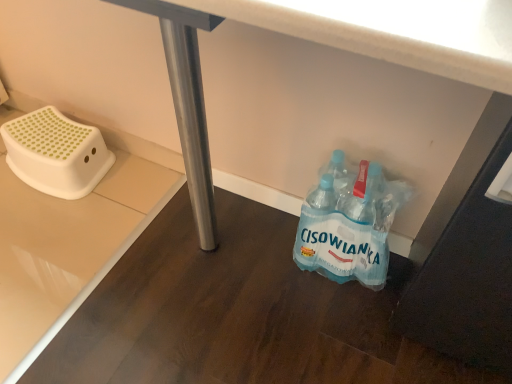
In order to click on free point to the left of translucent plastic bottles at lower right in this screenshot , I will do `click(263, 260)`.